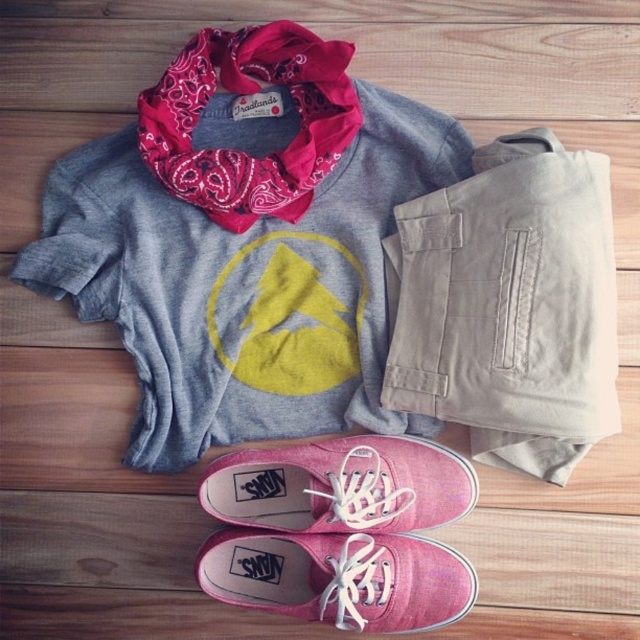
Looking at this image, you need to pack your bag for a trip and have limited space. You have to choose between the matte gray sweatshirt with yellow graphic at center and the pink canvas shoe at lower center. Which item should you prioritize packing based on their sizes?

The matte gray sweatshirt with yellow graphic at center is bigger than the pink canvas shoe at lower center, so you should prioritize packing the smaller pink canvas shoe at lower center to save space.

You are trying to decide which pair of footwear to wear with the outfit. The pink canvas shoe at lower center and the pink canvas sneakers at lower center are both options. Which one has a larger size?

The pink canvas shoe at lower center is bigger than the pink canvas sneakers at lower center.

You are organizing a closet and need to place the matte gray sweatshirt with yellow graphic at center and the pink canvas shoe at lower center into a drawer. The drawer has a depth of 10 cm. Can you fit both items into the drawer without overlapping?

The matte gray sweatshirt with yellow graphic at center is further to the viewer than the pink canvas shoe at lower center, meaning the sweatshirt is closer to you. Since the drawer has a depth of 10 cm, you can fit both items by arranging them side by side horizontally, as their combined depth should be within the drawer space.